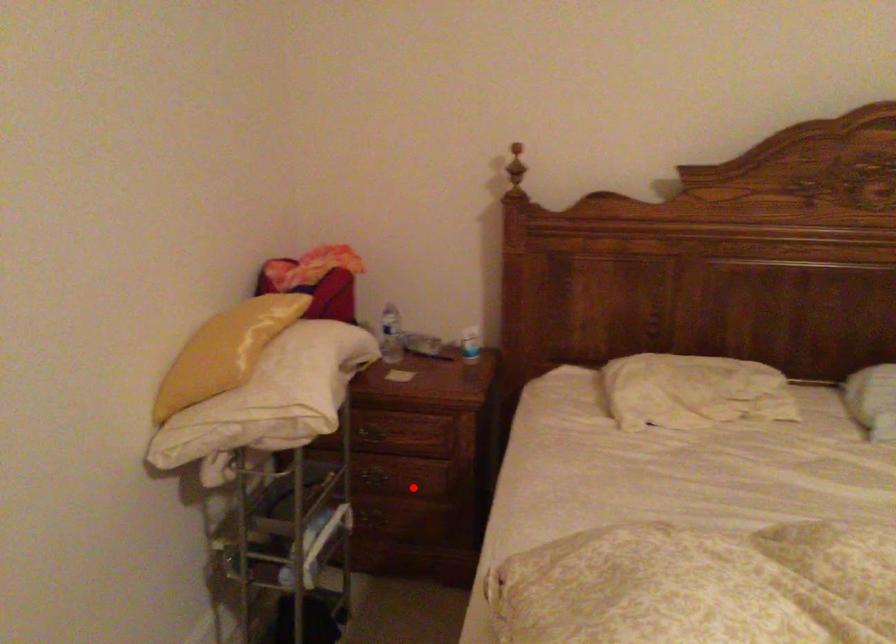
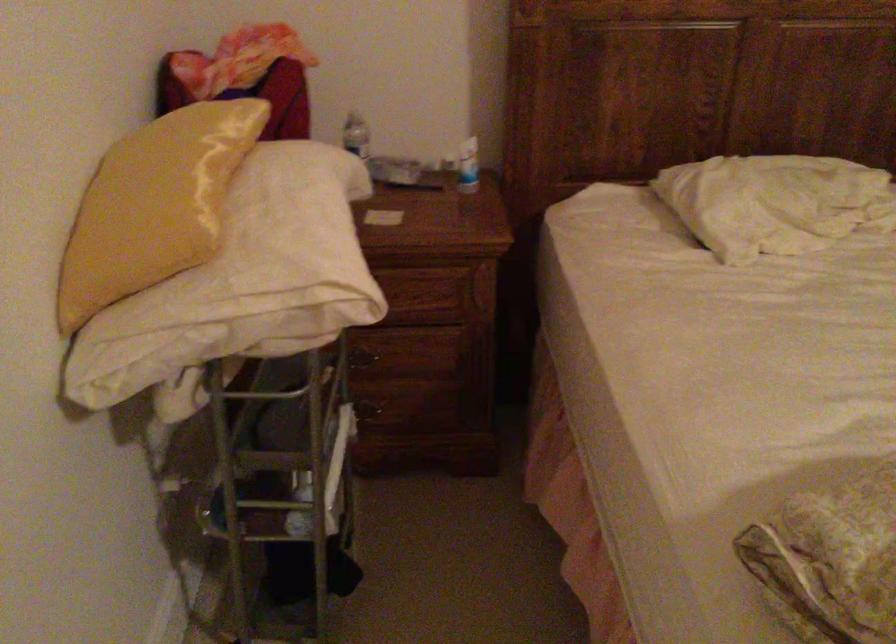
Question: I am providing you with two images of the same scene from different viewpoints. Image1 has a red point marked. In image2, the corresponding 3D location appears at what relative position? Reply with the corresponding letter.

Choices:
 (A) Closer
 (B) Farther

Answer: (A)